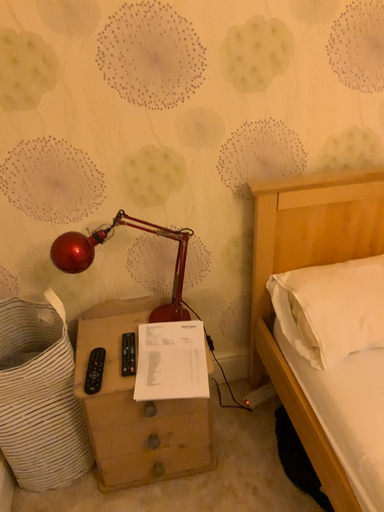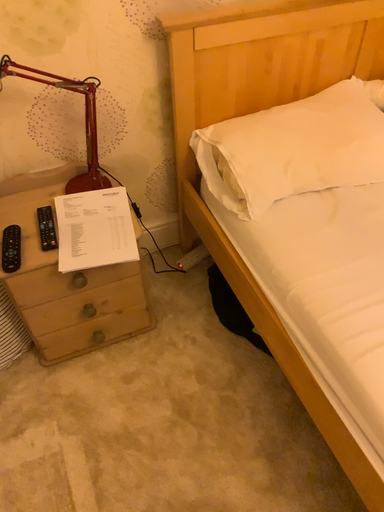
Question: How did the camera likely rotate when shooting the video?

Choices:
 (A) rotated downward
 (B) rotated upward

Answer: (A)